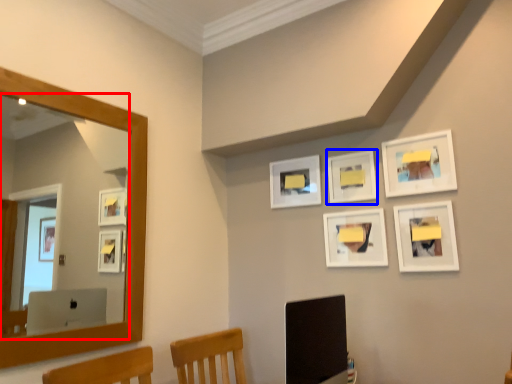
Question: Which object appears farthest to the camera in this image, mirror (highlighted by a red box) or picture frame (highlighted by a blue box)?

Choices:
 (A) mirror
 (B) picture frame

Answer: (B)